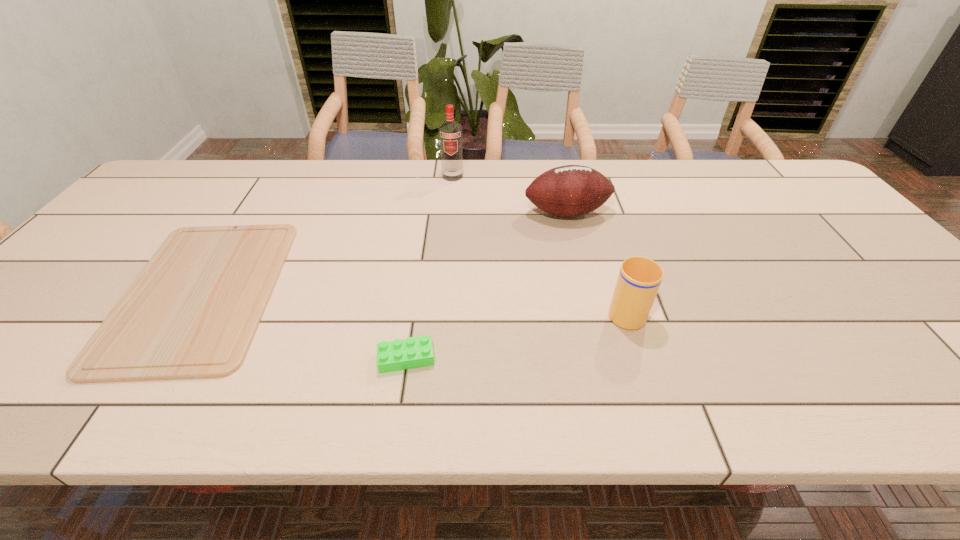
This screenshot has height=540, width=960. In order to click on free spot at the far left corner of the desktop in this screenshot , I will do `click(196, 195)`.

Identify the location of vacant space at the far right corner. The height and width of the screenshot is (540, 960). (807, 191).

Find the location of a particular element. This screenshot has width=960, height=540. vacant space in between the Lego and the leftmost object is located at coordinates (304, 325).

The height and width of the screenshot is (540, 960). Identify the location of vacant point located between the chopping board and the football (American). (384, 252).

Where is `vacant area that lies between the football (American) and the leftmost object`? vacant area that lies between the football (American) and the leftmost object is located at coordinates (384, 252).

Identify the location of vacant area that lies between the cup and the football (American). (596, 261).

Where is `free space between the football (American) and the vodka`? free space between the football (American) and the vodka is located at coordinates (510, 194).

This screenshot has height=540, width=960. In order to click on free spot between the cup and the farthest object in this screenshot , I will do `click(539, 244)`.

Identify the location of empty space that is in between the vodka and the fourth tallest object. (429, 267).

I want to click on vacant area that lies between the shortest object and the cup, so click(x=414, y=301).